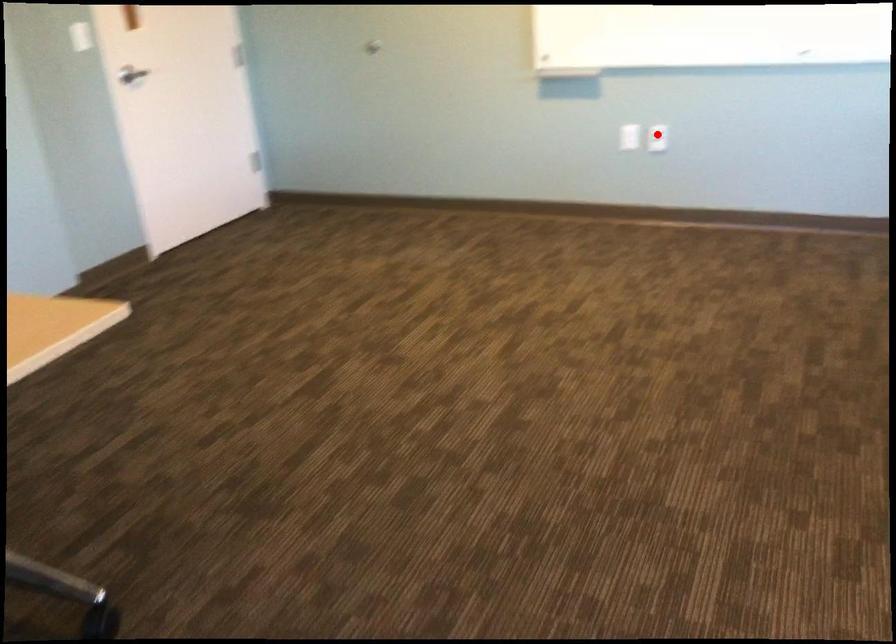
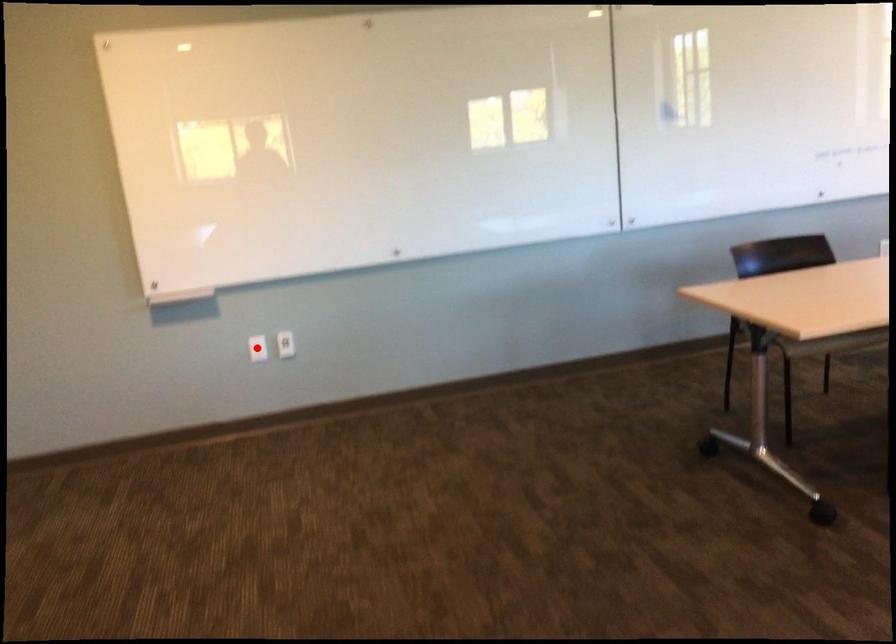
I am providing you with two images of the same scene from different viewpoints. A red point is marked on the first image and another point is marked on the second image. Do the highlighted points in image1 and image2 indicate the same real-world spot?

No